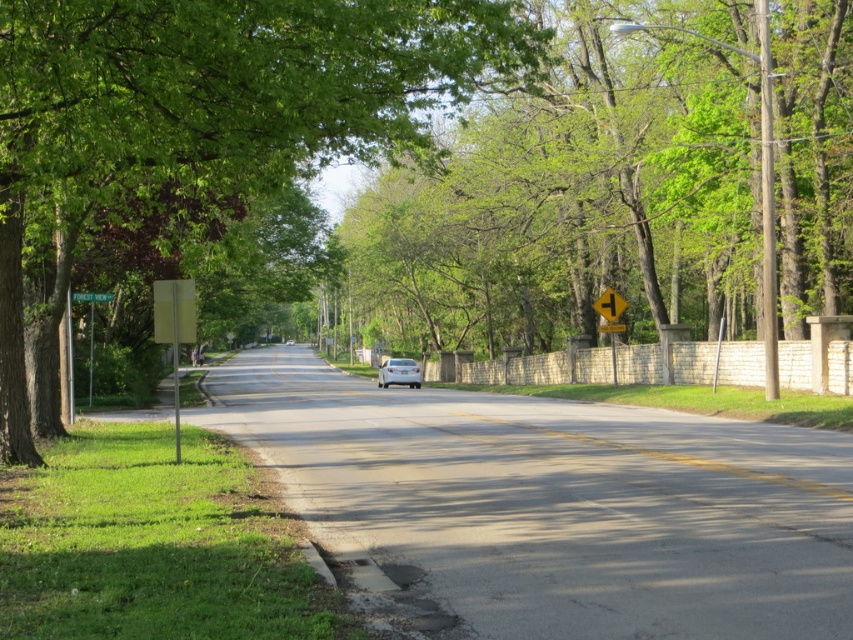
You are a pedestrian standing on the sidewalk next to the yellow painted line at center and the white glossy sedan at center. If you want to cross the road, which object should you look out for first as you step onto the road?

You should look out for the white glossy sedan at center first because it is longer than the yellow painted line at center, making it a larger obstacle to avoid.

You are driving a car and see the green metallic street sign at left and the yellow reflective plastic at center. Which object is closer to you?

The green metallic street sign at left is closer to you because it is in front of the yellow reflective plastic at center.

You are a pedestrian standing on the sidewalk and want to cross the road to the other side. You see a green leafy tree at center and a white glossy sedan at center. Which object is higher from the ground?

The green leafy tree at center is above the white glossy sedan at center, so the green leafy tree at center is higher from the ground.